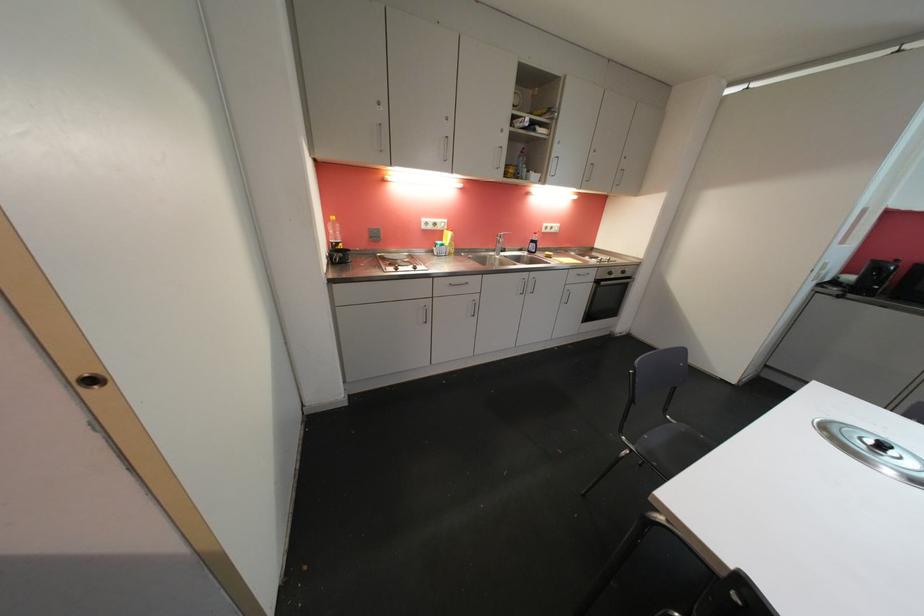
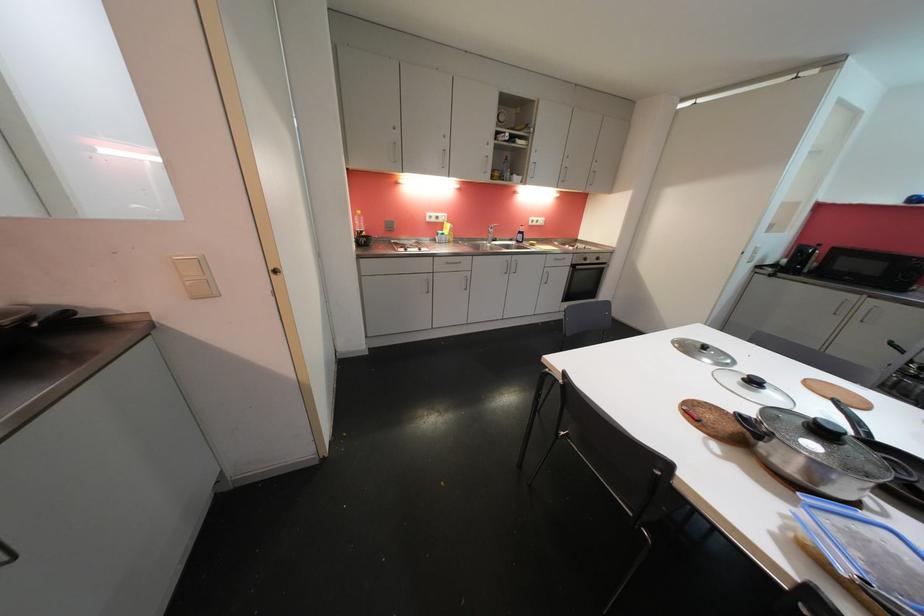
Locate, in the second image, the point that corresponds to the point at 874,445 in the first image.

(703, 349)